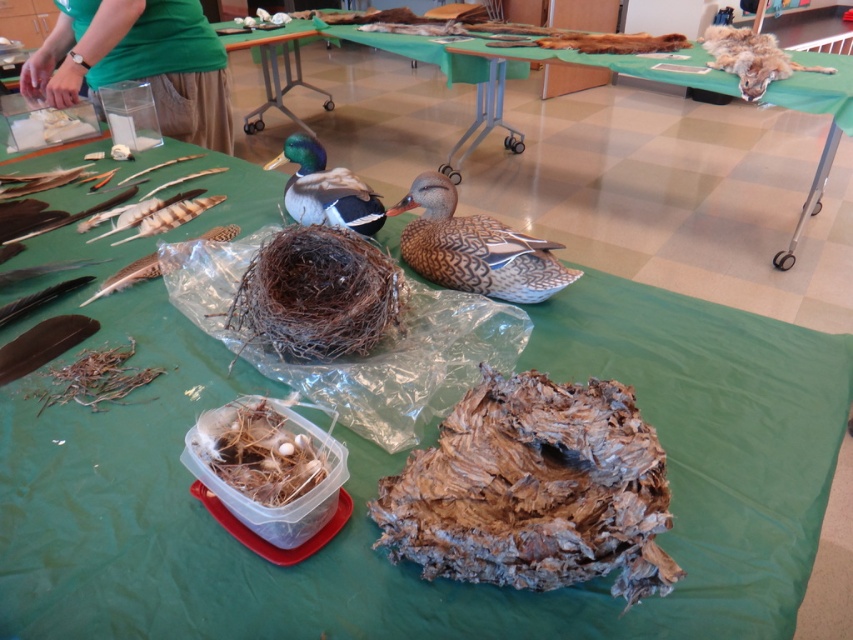
You are a child visiting an exhibition and see the wooden duck at center and the shiny green duck at center on a table. Which duck can you hold in one hand more easily?

The shiny green duck at center is smaller in size than the wooden duck at center, so it can be held in one hand more easily.

You are standing 10 feet away from the display table. You want to pick up the wooden duck at center without moving closer. Is it within your reach?

The wooden duck at center is 8.90 feet away from the camera, so yes, it is within reach since you are standing 10 feet away and can extend your arm to reach it.

You are a student participating in a school project where you need to place a ruler between the brown speckled duck at center and the shiny green duck at center. How far apart are these two ducks in inches?

The brown speckled duck at center and shiny green duck at center are 9.59 inches apart from each other, so the ruler would measure exactly 9.59 inches between them.